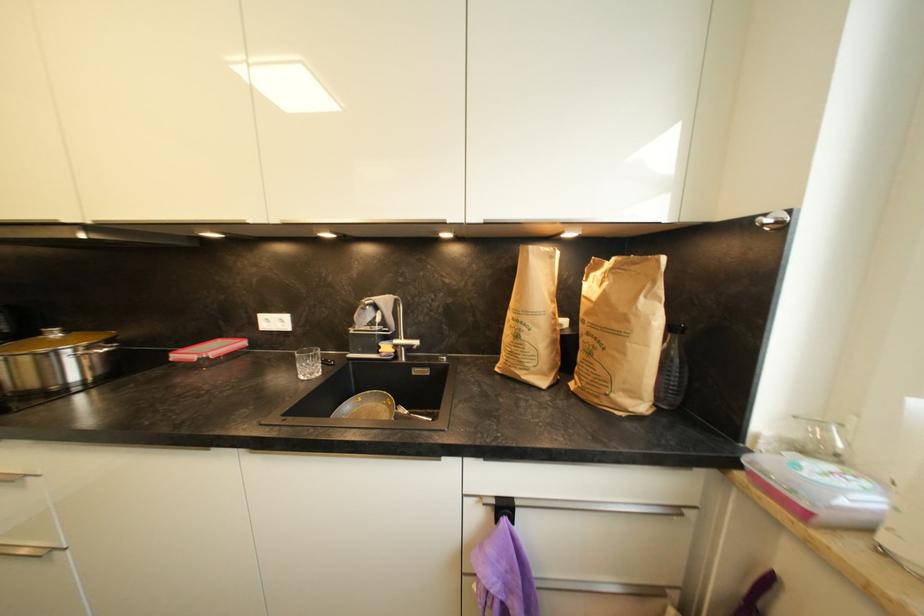
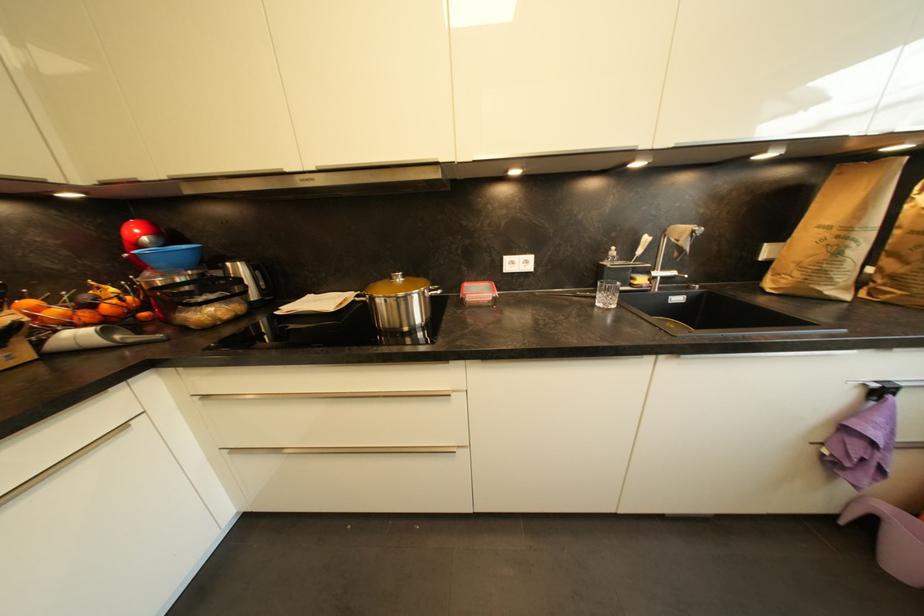
Question: The images are taken continuously from a first-person perspective. In which direction are you moving?

Choices:
 (A) Left
 (B) Right
 (C) Forward
 (D) Backward

Answer: (A)